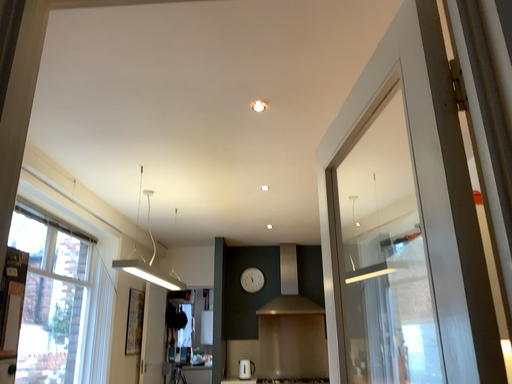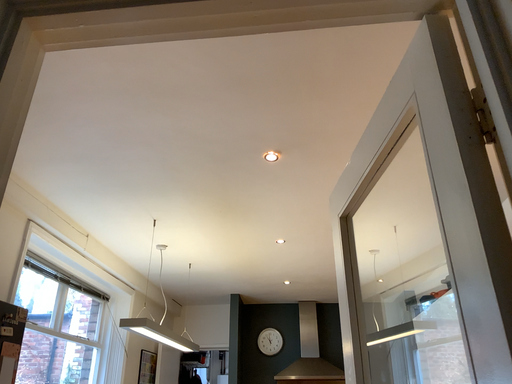
Question: Which way did the camera rotate in the video?

Choices:
 (A) rotated upward
 (B) rotated downward

Answer: (A)